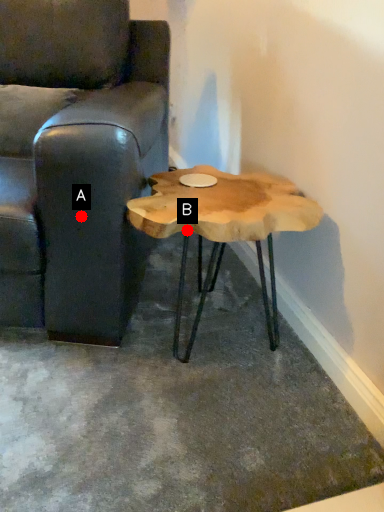
Question: Two points are circled on the image, labeled by A and B beside each circle. Which point is closer to the camera taking this photo?

Choices:
 (A) A is closer
 (B) B is closer

Answer: (B)